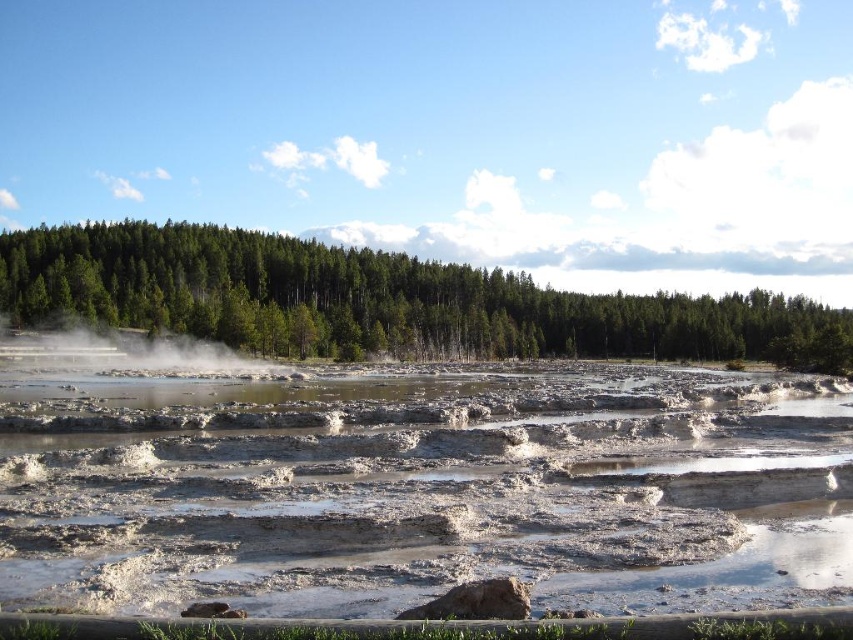
You are a park ranger guiding visitors through the geothermal area. You see the muddy water at center and the green matte forest at center. Which one is located to the left when facing the scene?

The muddy water at center is positioned on the left side of green matte forest at center, so when facing the scene, the muddy water at center is to the left of the green matte forest at center.

You are a park ranger assessing the geothermal area. You observe the muddy water at center and the green matte forest at center. Which area covers a smaller portion of the scene?

The muddy water at center occupies less space than the green matte forest at center, so the muddy water at center covers a smaller portion of the scene.